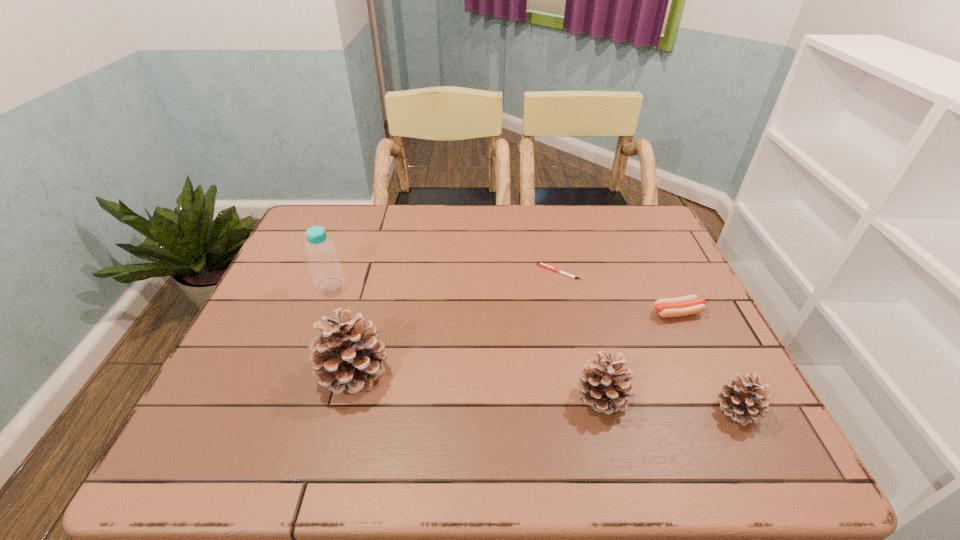
Choose which pinecone is the third nearest neighbor to the sausage. Please provide its 2D coordinates. Your answer should be formatted as a tuple, i.e. [(x, y)], where the tuple contains the x and y coordinates of a point satisfying the conditions above.

[(349, 357)]

Find the location of `pinecone that is the second closest one to the leftmost object`. pinecone that is the second closest one to the leftmost object is located at coordinates (604, 385).

Locate an element on the screen. The image size is (960, 540). vacant region that satisfies the following two spatial constraints: 1. on the clicker of the shortest object; 2. on the front side of the leftmost pinecone is located at coordinates (580, 372).

Identify the location of free location that satisfies the following two spatial constraints: 1. on the clicker of the pen; 2. on the left side of the second pinecone from left to right. (585, 396).

Find the location of a particular element. This screenshot has height=540, width=960. vacant area in the image that satisfies the following two spatial constraints: 1. on the clicker of the pen; 2. on the right side of the second tallest pinecone is located at coordinates (585, 396).

Find the location of a particular element. This screenshot has width=960, height=540. vacant position in the image that satisfies the following two spatial constraints: 1. on the clicker of the shortest object; 2. on the front side of the bottle is located at coordinates (562, 285).